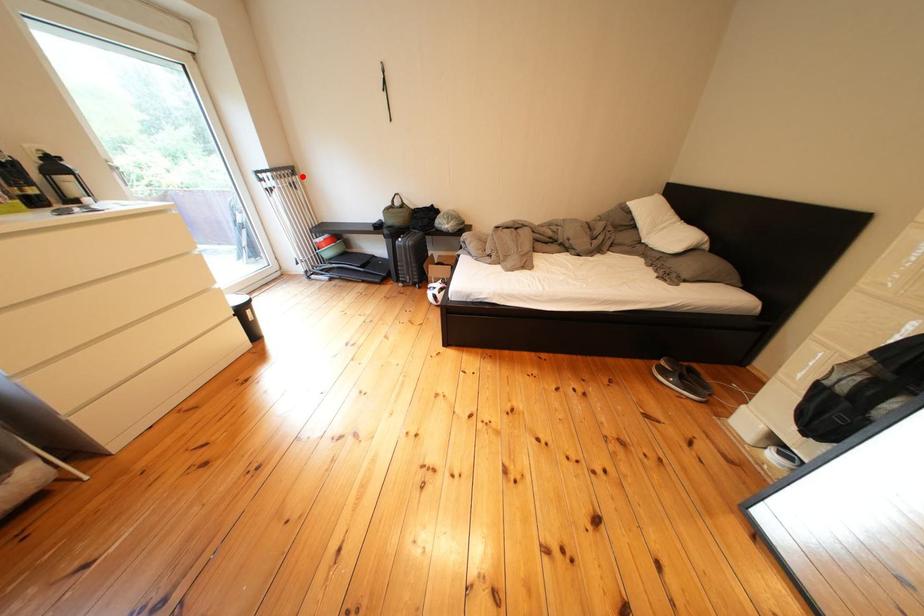
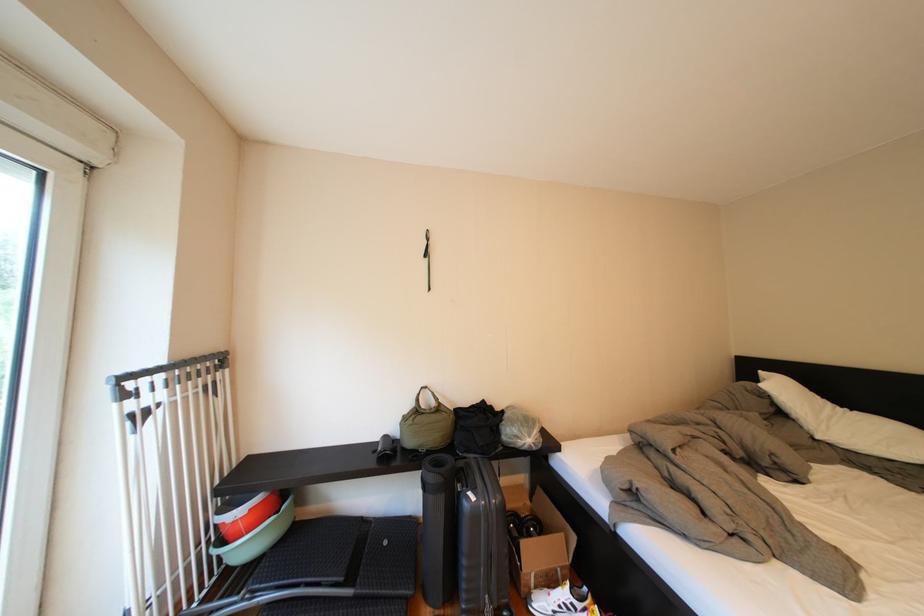
Question: I am providing you with two images of the same scene from different viewpoints. Given a red point in image1, look at the same physical point in image2. Is it:

Choices:
 (A) Closer to the viewpoint
 (B) Farther from the viewpoint

Answer: (B)